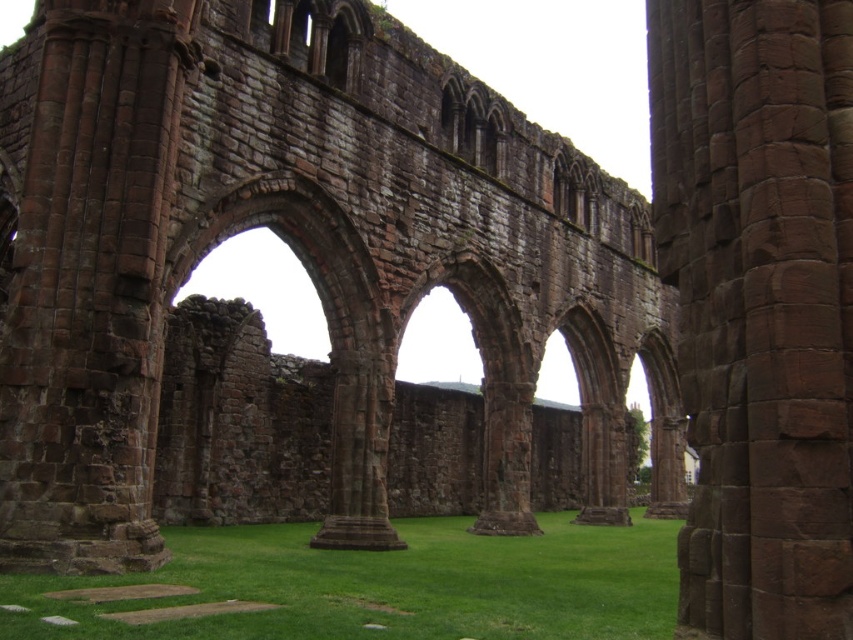
You are an archaeologist examining the ruins of a medieval structure. You notice a brown stone pillar at center and green grass at center. Which object has a smaller width?

The brown stone pillar at center is thinner than the green grass at center, so the brown stone pillar at center has a smaller width.